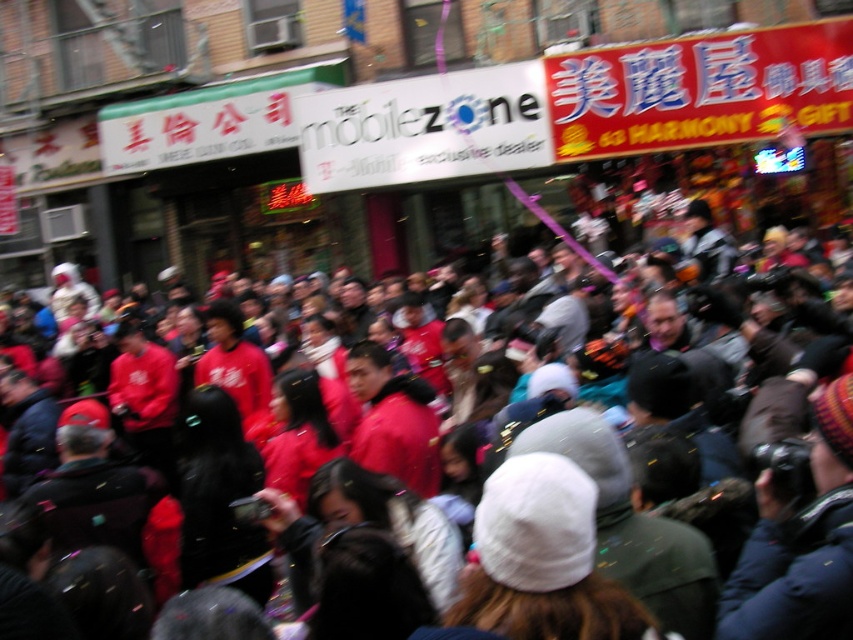
Is point (401, 131) positioned before point (723, 371)?

No, it is behind (723, 371).

Describe the element at coordinates (424, 129) in the screenshot. I see `white matte sign at center` at that location.

The image size is (853, 640). Identify the location of white matte sign at center. (424, 129).

Is point (834, 353) closer to viewer compared to point (837, 492)?

No.

Who is taller, red matte jackets at center or knitted wool hat at center?

With more height is red matte jackets at center.

Is point (668, 388) positioned before point (776, 618)?

No, it is not.

The width and height of the screenshot is (853, 640). In order to click on red matte jackets at center in this screenshot , I will do [x=780, y=396].

Is the position of white matte sign at center less distant than that of knitted wool hat at center?

No, white matte sign at center is further to the viewer.

Can you confirm if white matte sign at center is positioned to the right of knitted wool hat at center?

In fact, white matte sign at center is to the left of knitted wool hat at center.

Which is behind, point (358, 173) or point (782, 552)?

The point (358, 173) is more distant.

Find the location of a particular element. white matte sign at center is located at coordinates (424, 129).